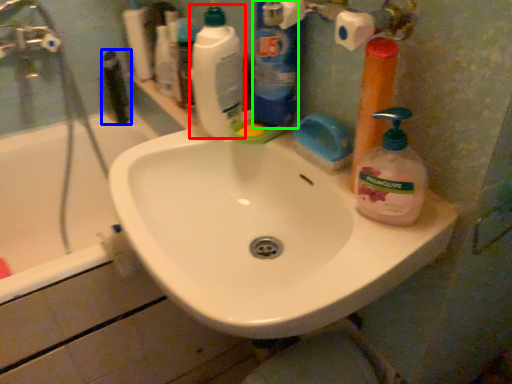
Question: Which object is the closest to the cleaning product (highlighted by a red box)? Choose among these: toiletry (highlighted by a blue box) or cleaning product (highlighted by a green box).

Choices:
 (A) toiletry
 (B) cleaning product

Answer: (B)